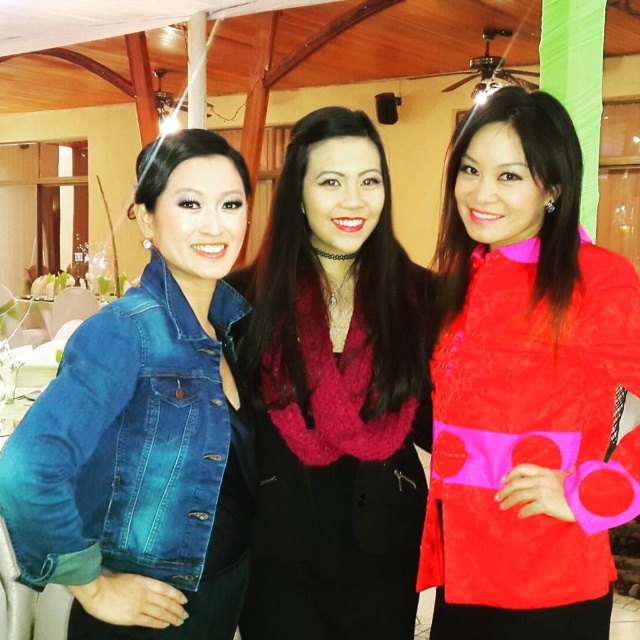
Can you confirm if suede red blouse at center is bigger than velvet red scarf at center?

Yes, suede red blouse at center is bigger than velvet red scarf at center.

Does suede red blouse at center have a smaller size compared to velvet red scarf at center?

No.

Who is more distant from viewer, (506, 356) or (413, 292)?

Point (413, 292)

Image resolution: width=640 pixels, height=640 pixels. I want to click on suede red blouse at center, so click(x=522, y=381).

Is suede red blouse at center above denim jacket at left?

Correct, suede red blouse at center is located above denim jacket at left.

Which is in front, point (493, 588) or point (161, 432)?

Point (161, 432) is more forward.

Image resolution: width=640 pixels, height=640 pixels. Find the location of `suede red blouse at center`. suede red blouse at center is located at coordinates (522, 381).

Between denim jacket at left and velvet red scarf at center, which one is positioned lower?

denim jacket at left

Is denim jacket at left wider than velvet red scarf at center?

No, denim jacket at left is not wider than velvet red scarf at center.

Describe the element at coordinates (147, 426) in the screenshot. I see `denim jacket at left` at that location.

The image size is (640, 640). I want to click on denim jacket at left, so click(147, 426).